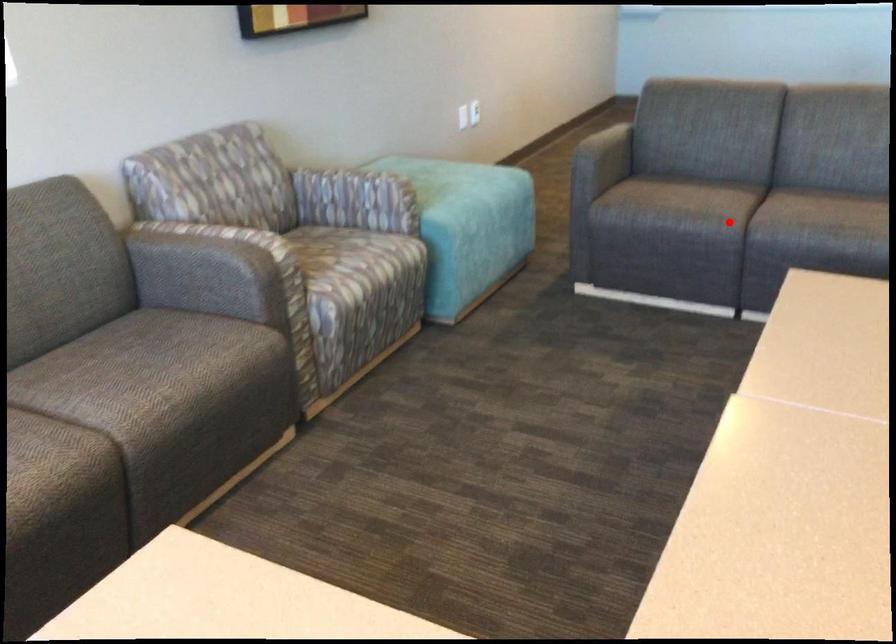
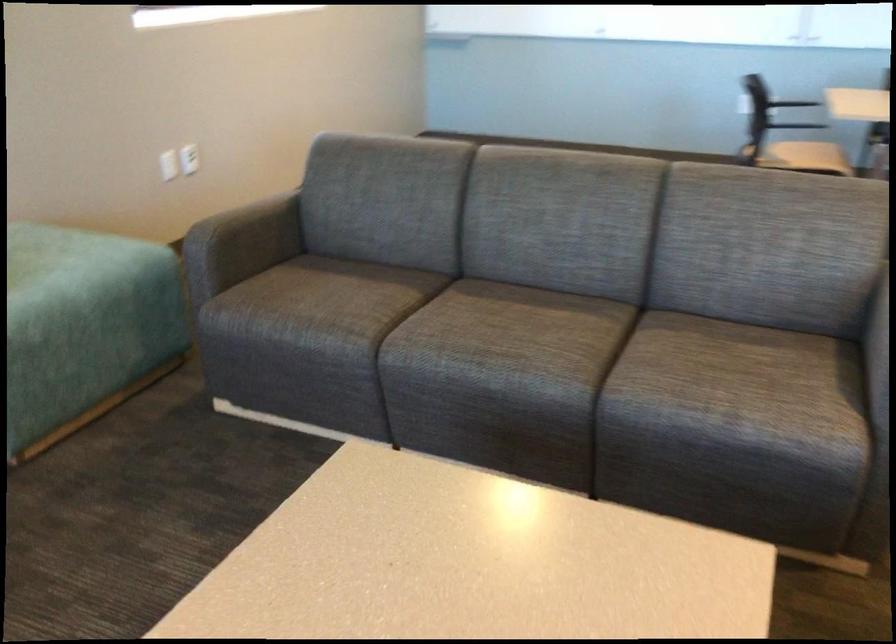
Question: I am providing you with two images of the same scene from different viewpoints. A red point is shown in image1. For the corresponding object point in image2, is it positioned nearer or farther from the camera?

Choices:
 (A) Nearer
 (B) Farther

Answer: (A)